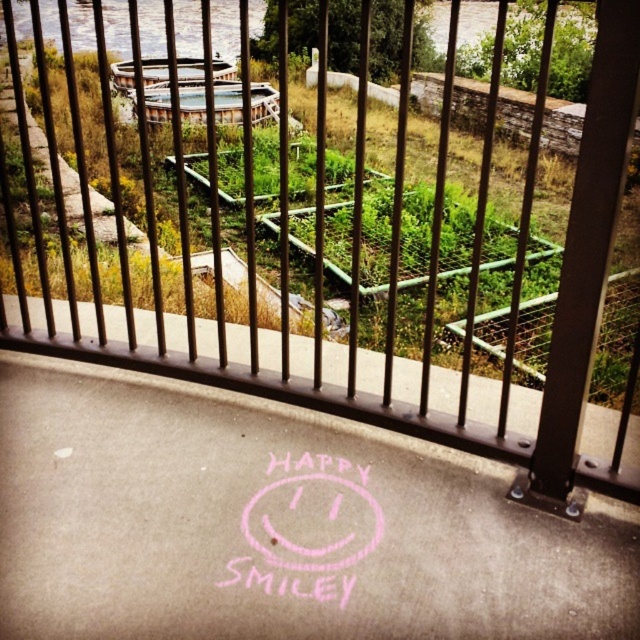
Is point (579, 544) farther from viewer compared to point (349, 468)?

That is False.

Can you confirm if pink chalk drawing at center is positioned to the right of pink chalk smiley face at center?

In fact, pink chalk drawing at center is to the left of pink chalk smiley face at center.

You are a GUI agent. You are given a task and a screenshot of the screen. Output one action in this format:
    pyautogui.click(x=<x>, y=<y>)
    Task: Click on the pink chalk drawing at center
    
    Given the screenshot: What is the action you would take?
    pyautogui.click(x=273, y=525)

Find the location of a particular element. This screenshot has width=640, height=640. pink chalk drawing at center is located at coordinates (x=273, y=525).